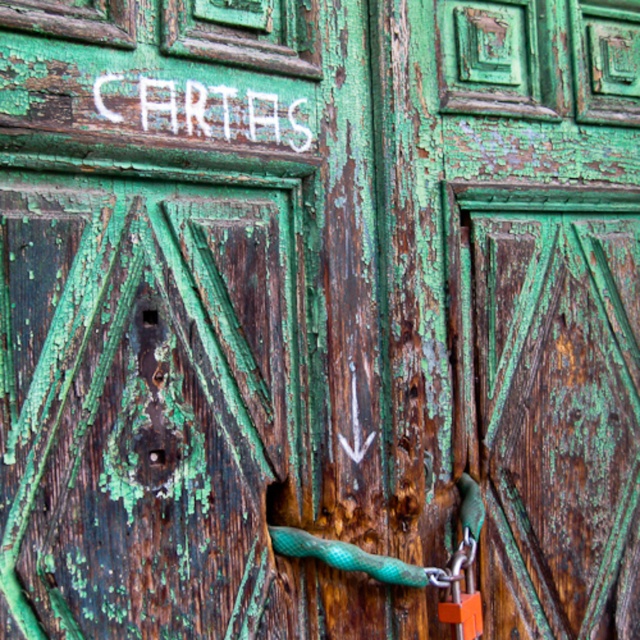
Does point (182, 92) come farther from viewer compared to point (467, 634)?

No, (182, 92) is closer to viewer.

Can you confirm if white painted letters at upper center is positioned below orange metallic padlock at lower right?

No, white painted letters at upper center is not below orange metallic padlock at lower right.

Where is `white painted letters at upper center`? This screenshot has height=640, width=640. white painted letters at upper center is located at coordinates click(202, 109).

Measure the distance between green weathered wood door at center and camera.

They are 1.10 meters apart.

Which is behind, point (289, 83) or point (196, 124)?

The point (289, 83) is behind.

Locate an element on the screen. This screenshot has width=640, height=640. green weathered wood door at center is located at coordinates (188, 320).

Where is `green weathered wood door at center`? The width and height of the screenshot is (640, 640). green weathered wood door at center is located at coordinates (188, 320).

Consider the image. Between green weathered wood door at center and orange metallic padlock at lower right, which one appears on the right side from the viewer's perspective?

orange metallic padlock at lower right

Does green weathered wood door at center appear on the right side of orange metallic padlock at lower right?

No, green weathered wood door at center is not to the right of orange metallic padlock at lower right.

Which is in front, point (372, 193) or point (449, 596)?

Point (449, 596)

Identify the location of green weathered wood door at center. (188, 320).